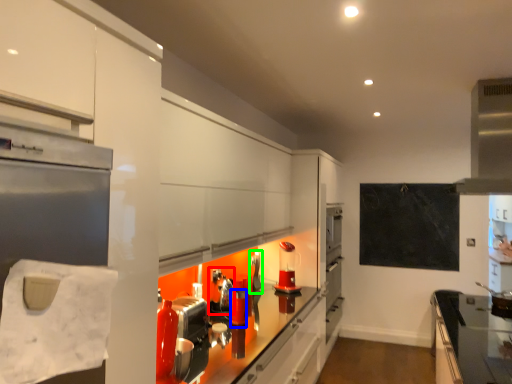
Question: Which is farther away from appliance (highlighted by a red box)? appliance (highlighted by a blue box) or appliance (highlighted by a green box)?

Choices:
 (A) appliance
 (B) appliance

Answer: (B)